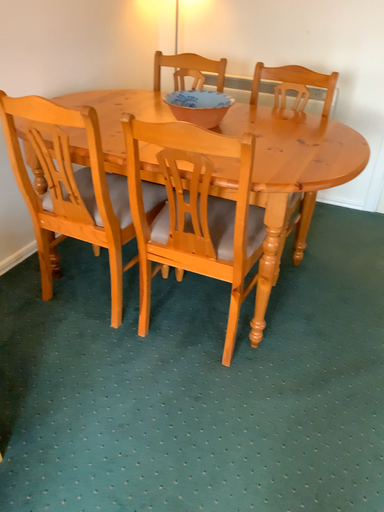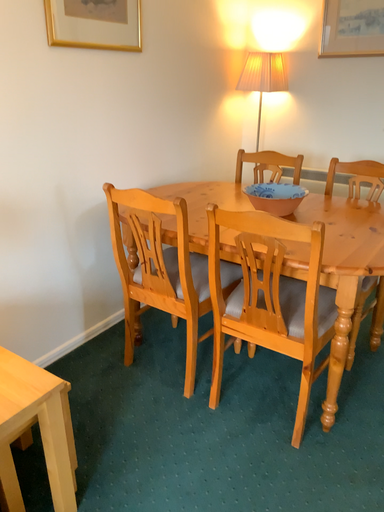
Question: How did the camera likely rotate when shooting the video?

Choices:
 (A) rotated upward
 (B) rotated downward

Answer: (A)